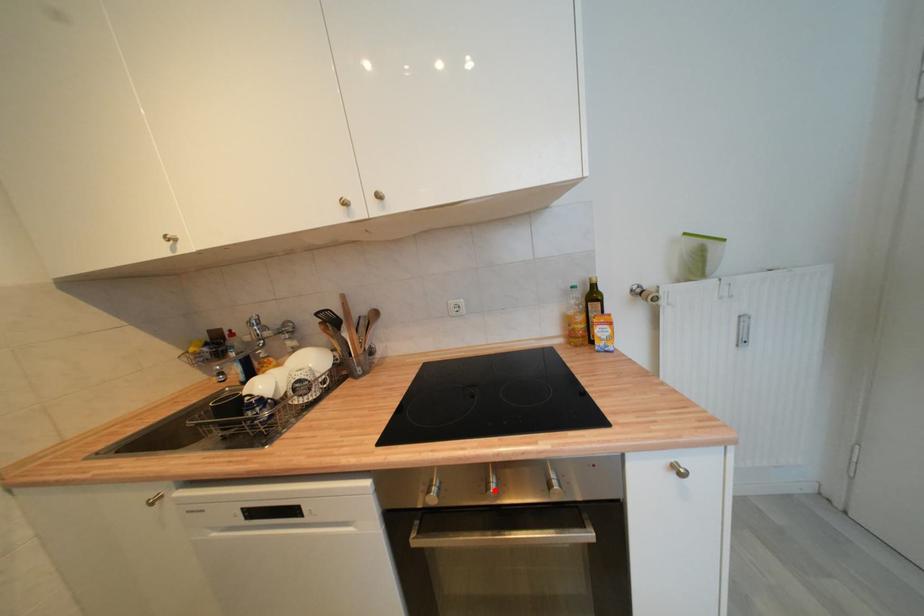
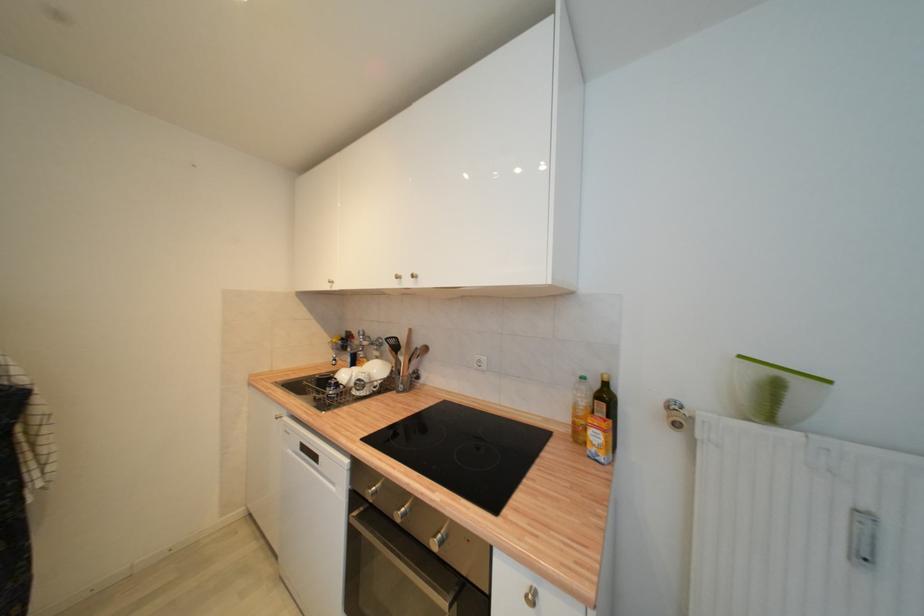
The point at the highlighted location is marked in the first image. Where is the corresponding point in the second image?

(405, 512)